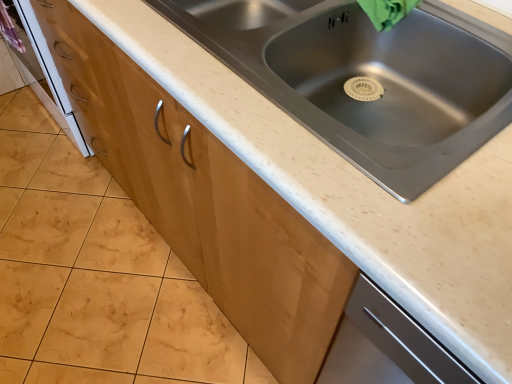
Where is `vacant point above matte wood cabinet at center (from a real-world perspective)`? vacant point above matte wood cabinet at center (from a real-world perspective) is located at coordinates (84, 246).